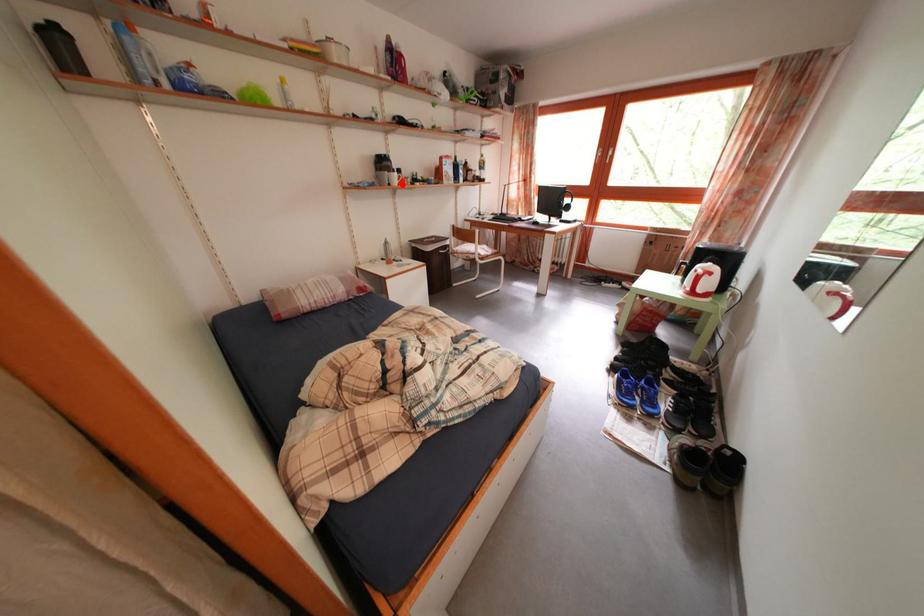
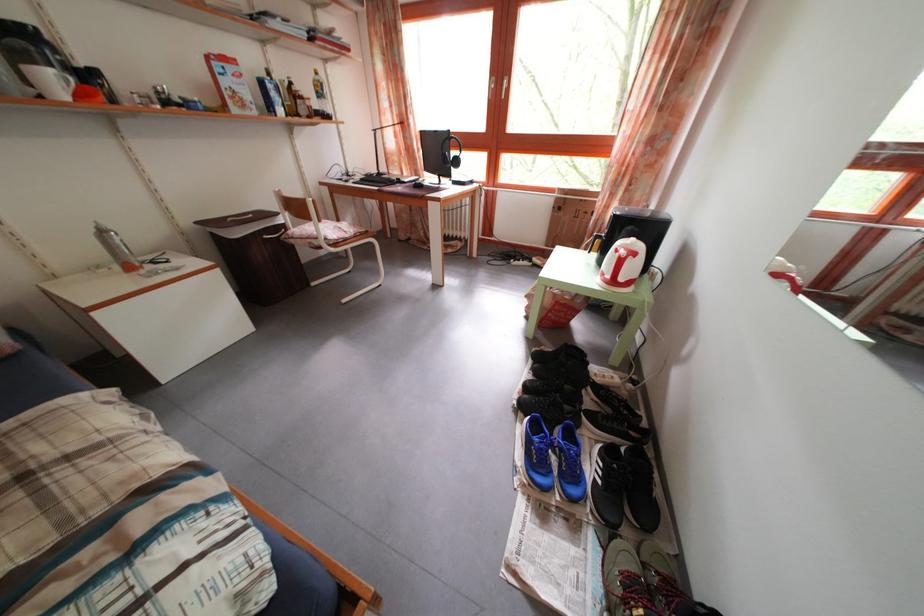
Question: I am providing you with two images of the same scene from different viewpoints. A red point is marked on the first image. At the location where the point appears in image 1, is it still visible in image 2?

Choices:
 (A) Yes
 (B) No

Answer: (A)